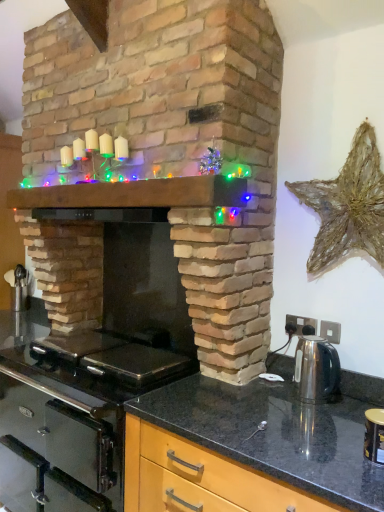
The height and width of the screenshot is (512, 384). What do you see at coordinates (164, 160) in the screenshot?
I see `brick fireplace at center` at bounding box center [164, 160].

Describe the element at coordinates (316, 369) in the screenshot. This screenshot has height=512, width=384. I see `satin silver kettle at right` at that location.

This screenshot has width=384, height=512. In order to click on wooden mantel at center in this screenshot , I will do `click(136, 194)`.

Locate an element on the screen. The image size is (384, 512). brick fireplace at center is located at coordinates (164, 160).

The image size is (384, 512). I want to click on gas stove on the left of matte black countertop at lower right, so click(101, 362).

In the image, is matte black countertop at lower right on the left side or the right side of black glass gas stove at lower left?

matte black countertop at lower right is positioned on black glass gas stove at lower left's right side.

From the image's perspective, which one is positioned lower, matte black countertop at lower right or black glass gas stove at lower left?

matte black countertop at lower right, from the image's perspective.

From a real-world perspective, is matte black countertop at lower right below black glass gas stove at lower left?

Yes, from a real-world perspective, matte black countertop at lower right is under black glass gas stove at lower left.

Considering the points (274, 42) and (81, 190), which point is in front, point (274, 42) or point (81, 190)?

The point (274, 42) is closer to the camera.

Looking at this image, is wooden mantel at center surrounded by brick fireplace at center?

Indeed, wooden mantel at center is located within brick fireplace at center.

Where is `fireplace above the wooden mantel at center (from the image's perspective)`? This screenshot has width=384, height=512. fireplace above the wooden mantel at center (from the image's perspective) is located at coordinates [164, 160].

How different are the orientations of brick fireplace at center and wooden mantel at center in degrees?

brick fireplace at center and wooden mantel at center are facing 0.00144 degrees away from each other.

From a real-world perspective, relative to matte black countertop at lower right, is wooden mantel at center vertically above or below?

wooden mantel at center is situated higher than matte black countertop at lower right in the real world.

Find the location of `cabinetry in front of the wooden mantel at center`. cabinetry in front of the wooden mantel at center is located at coordinates (199, 478).

Who is bigger, wooden mantel at center or matte black countertop at lower right?

matte black countertop at lower right is bigger.

Can you confirm if wooden mantel at center is positioned to the right of matte black countertop at lower right?

Incorrect, wooden mantel at center is not on the right side of matte black countertop at lower right.

Could you tell me if matte black countertop at lower right is facing wooden mantel at center?

No, matte black countertop at lower right is not facing towards wooden mantel at center.

Would you say matte black countertop at lower right is a long distance from wooden mantel at center?

No, matte black countertop at lower right is not far from wooden mantel at center.

Considering the sizes of objects matte black countertop at lower right and wooden mantel at center in the image provided, who is smaller, matte black countertop at lower right or wooden mantel at center?

With smaller size is wooden mantel at center.

From the picture: Would you consider satin silver kettle at right to be distant from wooden mantel at center?

Actually, satin silver kettle at right and wooden mantel at center are a little close together.

From a real-world perspective, which object stands above the other?

From a 3D spatial view, wooden mantel at center is above.

From the image's perspective, is satin silver kettle at right positioned above or below wooden mantel at center?

satin silver kettle at right is below wooden mantel at center.

Find the location of `kitchen appliance below the wooden mantel at center (from a real-world perspective)`. kitchen appliance below the wooden mantel at center (from a real-world perspective) is located at coordinates (316, 369).

From a real-world perspective, relative to black glass gas stove at lower left, is brick fireplace at center vertically above or below?

Clearly, from a real-world perspective, brick fireplace at center is above black glass gas stove at lower left.

Is brick fireplace at center placed right next to black glass gas stove at lower left?

brick fireplace at center is not next to black glass gas stove at lower left, and they're not touching.

Is point (54, 40) more distant than point (97, 366)?

That is True.

Can you tell me how much black glass gas stove at lower left and brick fireplace at center differ in facing direction?

0.00155 degrees.

Would you say black glass gas stove at lower left is to the left or to the right of brick fireplace at center in the picture?

black glass gas stove at lower left is positioned on brick fireplace at center's left side.

Which of these two, black glass gas stove at lower left or brick fireplace at center, is smaller?

Smaller between the two is black glass gas stove at lower left.

Considering their positions, is black glass gas stove at lower left located in front of or behind brick fireplace at center?

black glass gas stove at lower left is positioned farther from the viewer than brick fireplace at center.

You are a GUI agent. You are given a task and a screenshot of the screen. Output one action in this format:
    pyautogui.click(x=<x>, y=<y>)
    Task: Click on the gas stove that appears behind the matte black countertop at lower right
    The width and height of the screenshot is (384, 512).
    Given the screenshot: What is the action you would take?
    pyautogui.click(x=101, y=362)

This screenshot has width=384, height=512. What are the coordinates of `fireplace that appears in front of the wooden mantel at center` in the screenshot? It's located at (164, 160).

When comparing their distances from brick fireplace at center, does black glass gas stove at lower left or matte black countertop at lower right seem further?

matte black countertop at lower right.

Estimate the real-world distances between objects in this image. Which object is further from black glass gas stove at lower left, brick fireplace at center or satin silver kettle at right?

The object further to black glass gas stove at lower left is satin silver kettle at right.

When comparing their distances from matte black countertop at lower right, does black glass gas stove at lower left or wooden mantel at center seem closer?

Among the two, black glass gas stove at lower left is located nearer to matte black countertop at lower right.

Considering their positions, is satin silver kettle at right positioned closer to brick fireplace at center than black glass gas stove at lower left?

Based on the image, black glass gas stove at lower left appears to be nearer to brick fireplace at center.

Considering their positions, is satin silver kettle at right positioned further to brick fireplace at center than matte black countertop at lower right?

matte black countertop at lower right is positioned further to the anchor brick fireplace at center.

Estimate the real-world distances between objects in this image. Which object is further from satin silver kettle at right, wooden mantel at center or black glass gas stove at lower left?

wooden mantel at center is further to satin silver kettle at right.

Which object lies further to the anchor point matte black countertop at lower right, satin silver kettle at right or brick fireplace at center?

brick fireplace at center is further to matte black countertop at lower right.

Which object lies further to the anchor point matte black countertop at lower right, wooden mantel at center or black glass gas stove at lower left?

wooden mantel at center is further to matte black countertop at lower right.

Locate an element on the screen. mantle that lies between brick fireplace at center and black glass gas stove at lower left from top to bottom is located at coordinates (136, 194).

Identify the location of fireplace between wooden mantel at center and satin silver kettle at right from left to right. (164, 160).

Identify the location of gas stove that lies between brick fireplace at center and matte black countertop at lower right from top to bottom. (101, 362).

Identify the location of fireplace situated between black glass gas stove at lower left and satin silver kettle at right from left to right. The image size is (384, 512). (164, 160).